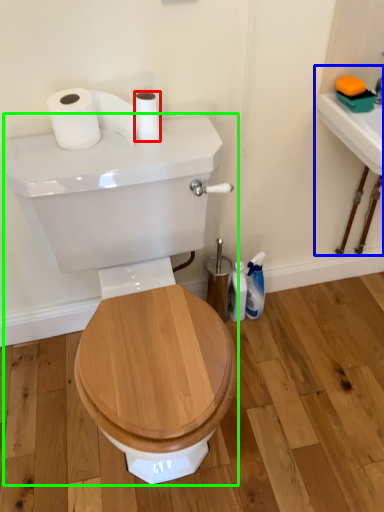
Question: Estimate the real-world distances between objects in this image. Which object is closer to toilet paper (highlighted by a red box), sink (highlighted by a blue box) or porcelain (highlighted by a green box)?

Choices:
 (A) sink
 (B) porcelain

Answer: (B)